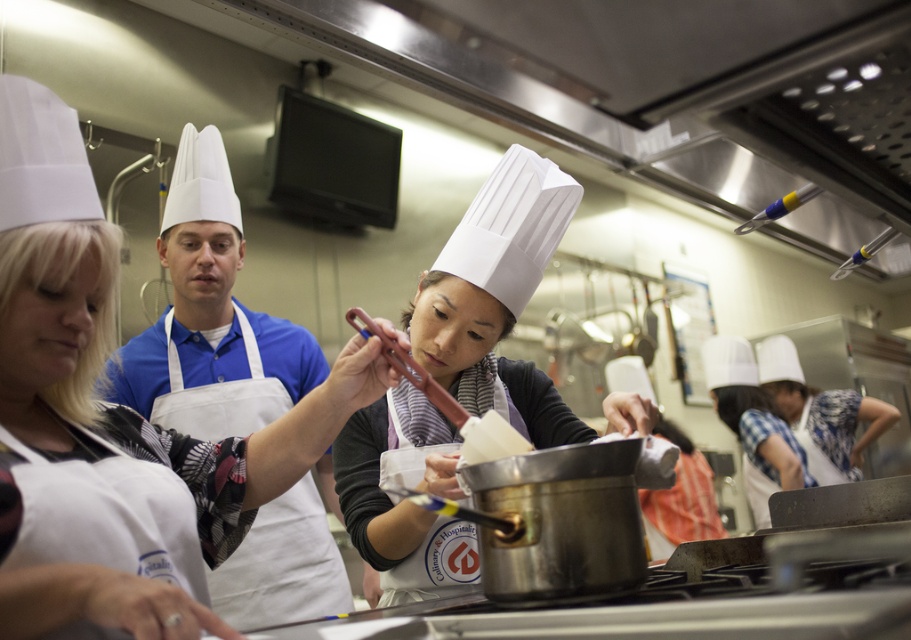
Is white matte chef hat at upper left taller than white chef hat at center?

No.

Does white matte chef hat at upper left have a lesser height compared to white chef hat at center?

Yes.

Which is in front, point (6, 376) or point (754, 388)?

Point (6, 376)

At what (x,y) coordinates should I click in order to perform the action: click on white matte chef hat at upper left. Please return your answer as a coordinate pair (x, y). This screenshot has width=911, height=640. Looking at the image, I should click on (111, 419).

Is white matte chef hat at center below white chef hat at center?

Actually, white matte chef hat at center is above white chef hat at center.

Which is more to the right, white matte chef hat at center or white chef hat at center?

white chef hat at center is more to the right.

Does point (341, 481) come in front of point (746, 429)?

Yes.

Where is `white matte chef hat at center`? white matte chef hat at center is located at coordinates (497, 298).

Is white matte chef hat at center in front of white cotton apron at center?

Yes, white matte chef hat at center is in front of white cotton apron at center.

Which is behind, point (362, 449) or point (278, 326)?

Point (278, 326)

Does point (425, 396) come farther from viewer compared to point (186, 387)?

No, (425, 396) is in front of (186, 387).

You are a GUI agent. You are given a task and a screenshot of the screen. Output one action in this format:
    pyautogui.click(x=<x>, y=<y>)
    Task: Click on the white matte chef hat at center
    
    Given the screenshot: What is the action you would take?
    (x=497, y=298)